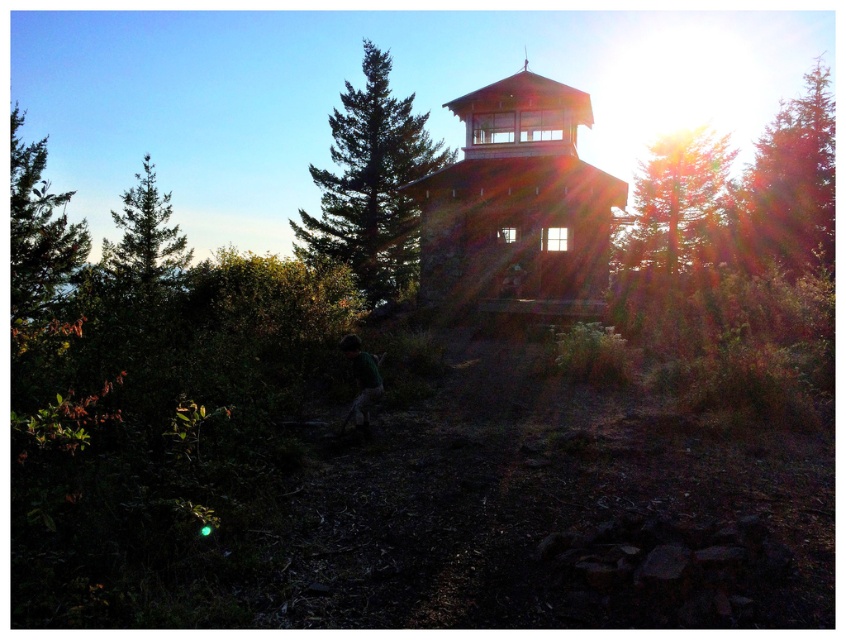
Question: Considering the relative positions of brown wooden tower at center and reddish-brown textured tree at upper right in the image provided, where is brown wooden tower at center located with respect to reddish-brown textured tree at upper right?

Choices:
 (A) right
 (B) left

Answer: (B)

Question: Considering the real-world distances, which object is closest to the brown wooden tower at center?

Choices:
 (A) green leafy tree at left
 (B) green textured pine tree at center
 (C) green needle-like tree at left

Answer: (B)

Question: Which point is farther from the camera taking this photo?

Choices:
 (A) (31, 227)
 (B) (673, 250)
 (C) (119, 264)
 (D) (462, 173)

Answer: (B)

Question: Is green leafy tree at upper right closer to camera compared to green needle-like tree at left?

Choices:
 (A) yes
 (B) no

Answer: (B)

Question: Based on their relative distances, which object is nearer to the reddish-brown textured tree at upper right?

Choices:
 (A) green leafy tree at left
 (B) green textured pine tree at center
 (C) brown wooden tower at center

Answer: (C)

Question: Can you confirm if reddish-brown textured tree at upper right is positioned to the right of green leafy tree at upper right?

Choices:
 (A) no
 (B) yes

Answer: (B)